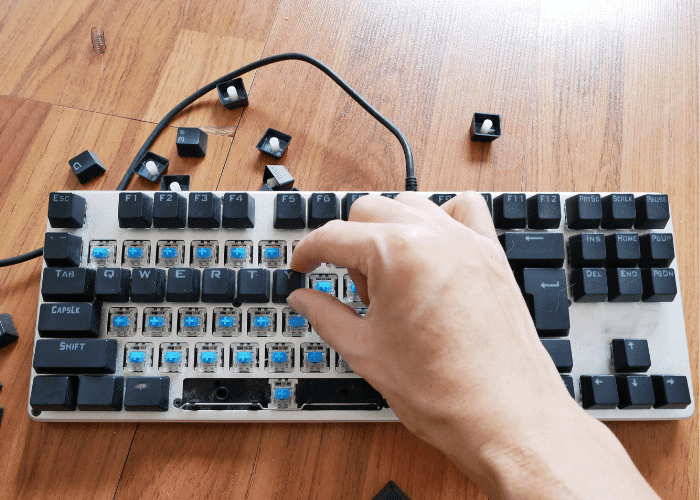
At what (x,y) coordinates should I click in order to perform the action: click on computer keyboard. Please return your answer as a coordinate pair (x, y). Looking at the image, I should click on (267, 335).